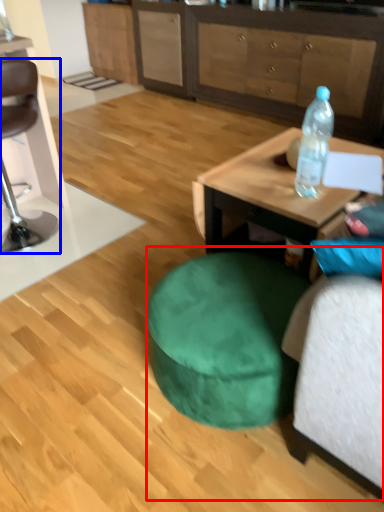
Question: Which point is further to the camera, bean bag chair (highlighted by a red box) or chair (highlighted by a blue box)?

Choices:
 (A) bean bag chair
 (B) chair

Answer: (B)